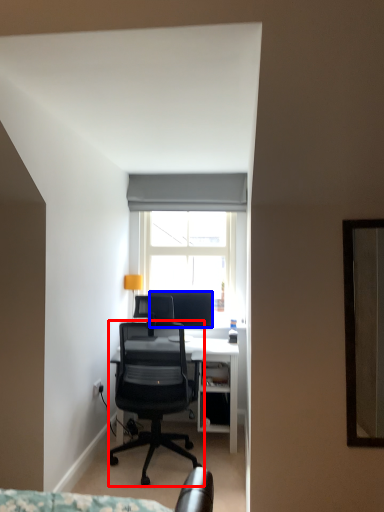
Question: Which point is closer to the camera, chair (highlighted by a red box) or television (highlighted by a blue box)?

Choices:
 (A) chair
 (B) television

Answer: (A)